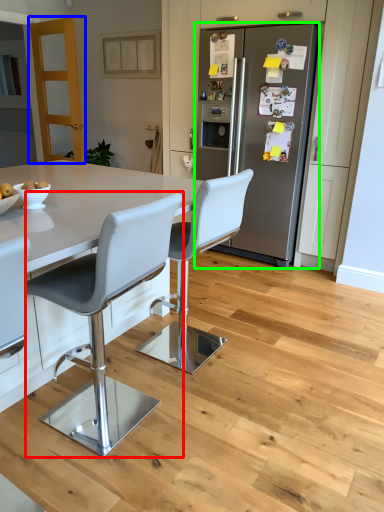
Question: Based on their relative distances, which object is nearer to chair (highlighted by a red box)? Choose from glass door (highlighted by a blue box) and refrigerator (highlighted by a green box).

Choices:
 (A) glass door
 (B) refrigerator

Answer: (B)